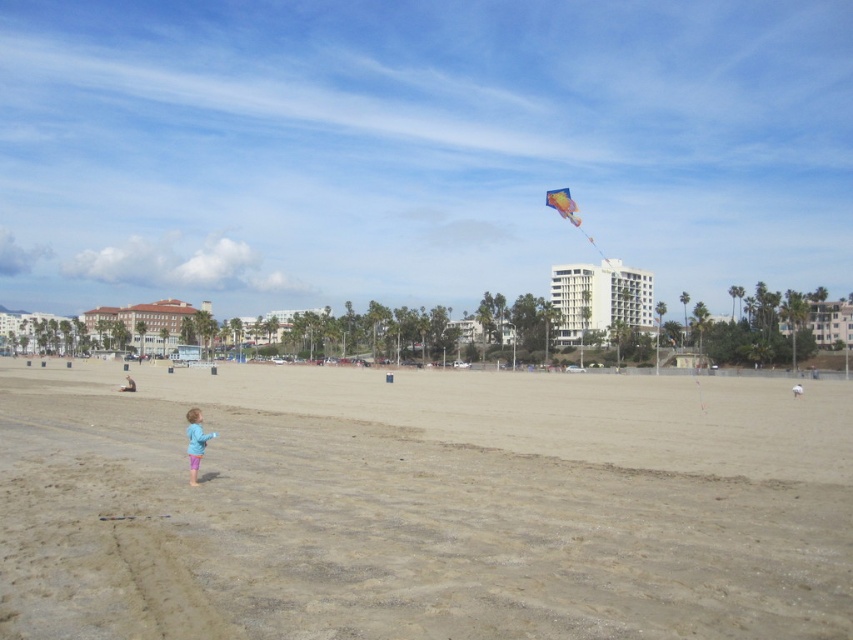
Between light blue fabric child at lower left and multicolored fabric kite at upper center, which one appears on the right side from the viewer's perspective?

multicolored fabric kite at upper center

Is light blue fabric child at lower left closer to camera compared to multicolored fabric kite at upper center?

Yes, light blue fabric child at lower left is in front of multicolored fabric kite at upper center.

Find the location of a particular element. This screenshot has width=853, height=640. light blue fabric child at lower left is located at coordinates (195, 442).

The width and height of the screenshot is (853, 640). I want to click on light blue fabric child at lower left, so click(x=195, y=442).

Between smooth sand beach at lower center and multicolored fabric kite at upper center, which one has less height?

With less height is smooth sand beach at lower center.

Is smooth sand beach at lower center bigger than multicolored fabric kite at upper center?

Actually, smooth sand beach at lower center might be smaller than multicolored fabric kite at upper center.

The image size is (853, 640). I want to click on smooth sand beach at lower center, so click(x=422, y=506).

Can you confirm if light blue fabric child at lower left is bigger than blue fabric person at lower left?

Incorrect, light blue fabric child at lower left is not larger than blue fabric person at lower left.

What do you see at coordinates (195, 442) in the screenshot? This screenshot has width=853, height=640. I see `light blue fabric child at lower left` at bounding box center [195, 442].

Who is more forward, (212,436) or (131,378)?

Positioned in front is point (212,436).

The image size is (853, 640). I want to click on light blue fabric child at lower left, so click(195, 442).